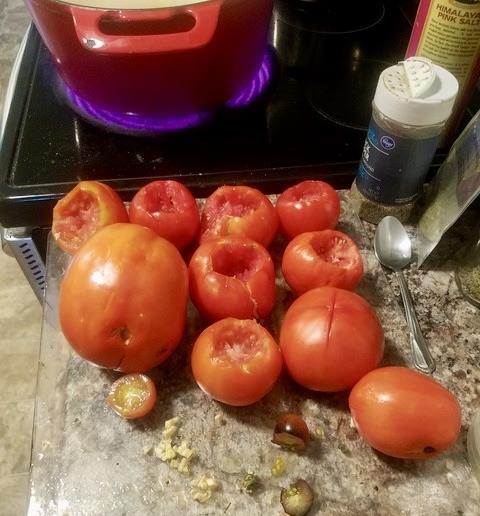
Locate an element on the screen. Image resolution: width=480 pixels, height=516 pixels. handle is located at coordinates (418, 352).